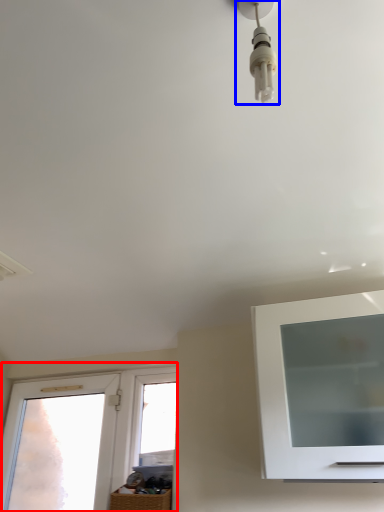
Question: Which point is further to the camera, window (highlighted by a red box) or light fixture (highlighted by a blue box)?

Choices:
 (A) window
 (B) light fixture

Answer: (A)